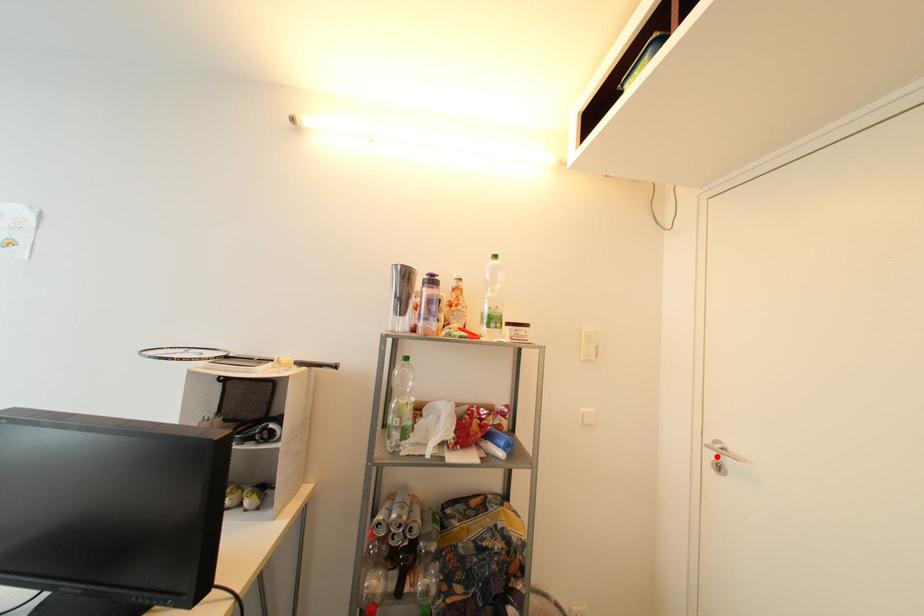
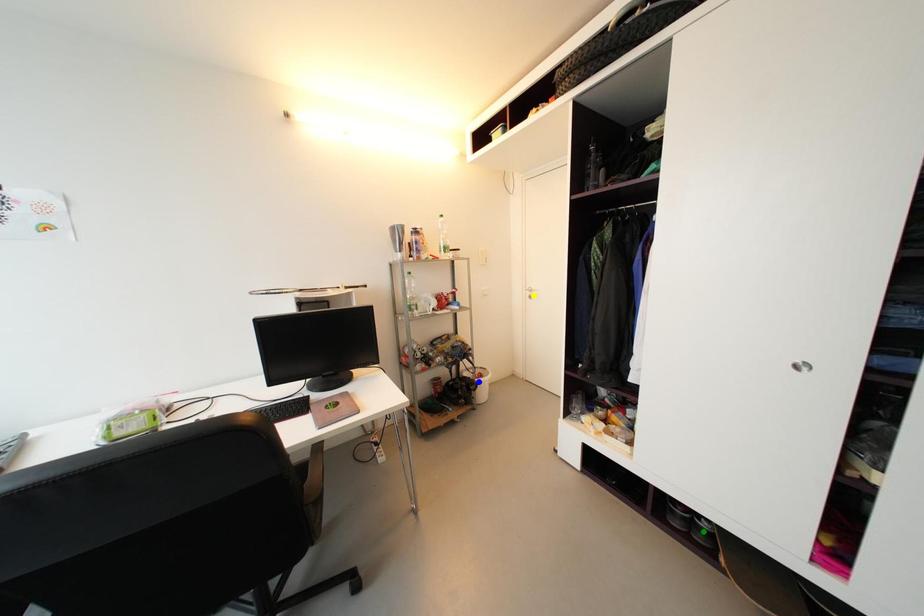
Question: I am providing you with two images of the same scene from different viewpoints. A red point is marked on the first image. You are given multiple points on the second image. Which mark in image 2 goes with the point in image 1?

Choices:
 (A) green point
 (B) blue point
 (C) yellow point

Answer: (C)